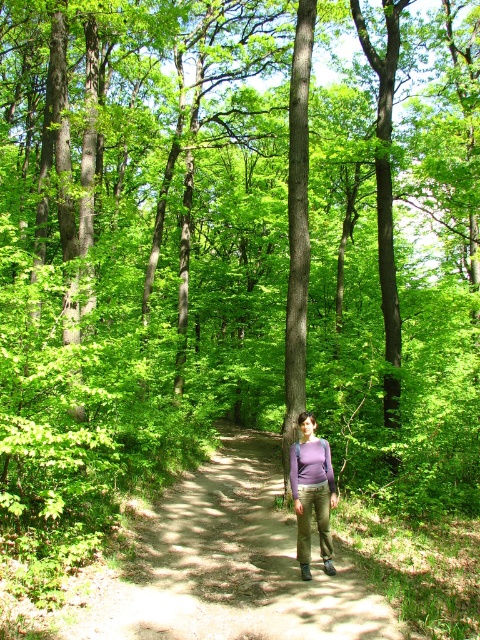
You are standing on the dirt path in the forest and see two points marked in the scene. The first point is at coordinates point [277,637] and the second point is at point [295,500]. Which point is closer to you?

Point [277,637] is in front of point [295,500], so it is closer to you.

You are a hiker who wants to walk along the dirt path at center while wearing the purple matte shirt at center. Considering the path width, will you have enough space to walk comfortably without touching the shirt?

The dirt path at center is wider than the purple matte shirt at center, so yes, there is enough space to walk comfortably without touching the shirt.